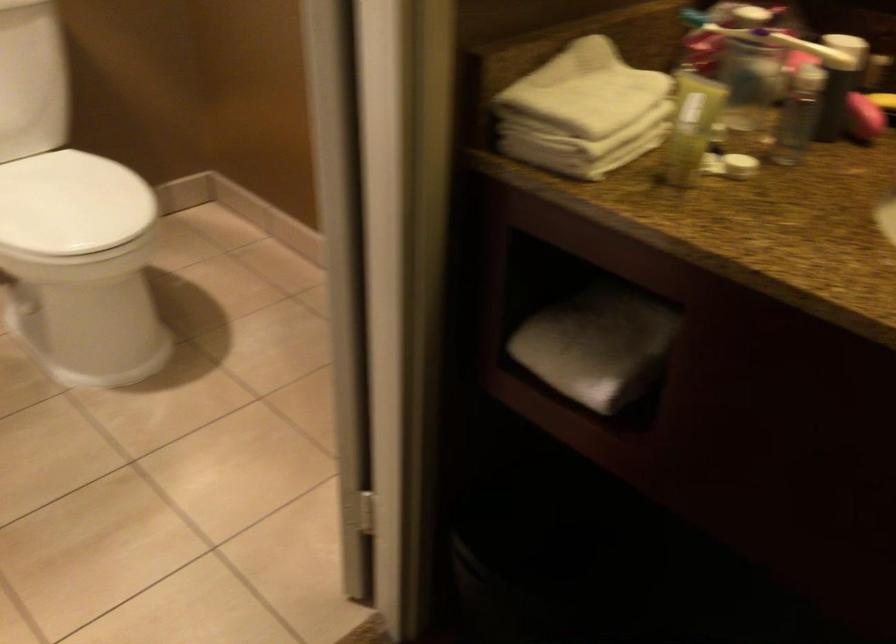
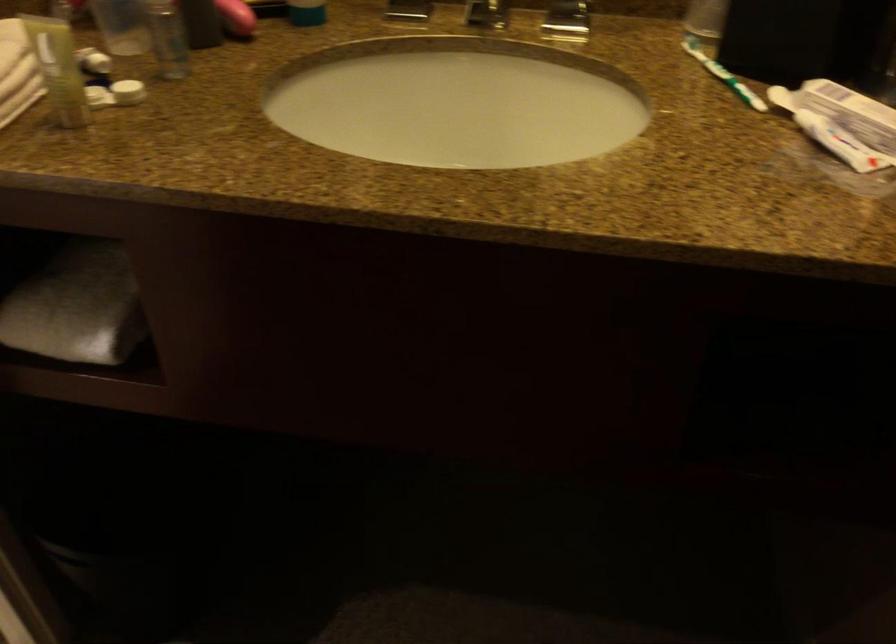
Locate, in the second image, the point that corresponds to point (592, 348) in the first image.

(76, 306)